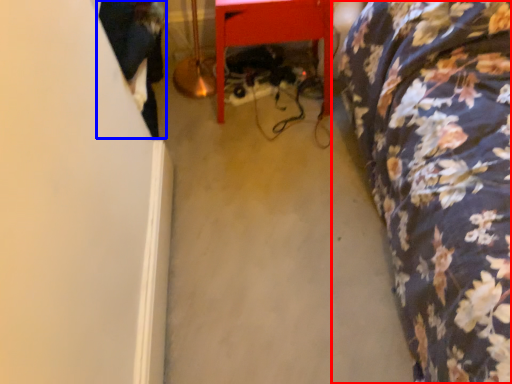
Question: Among these objects, which one is nearest to the camera, furniture (highlighted by a red box) or couple (highlighted by a blue box)?

Choices:
 (A) furniture
 (B) couple

Answer: (A)